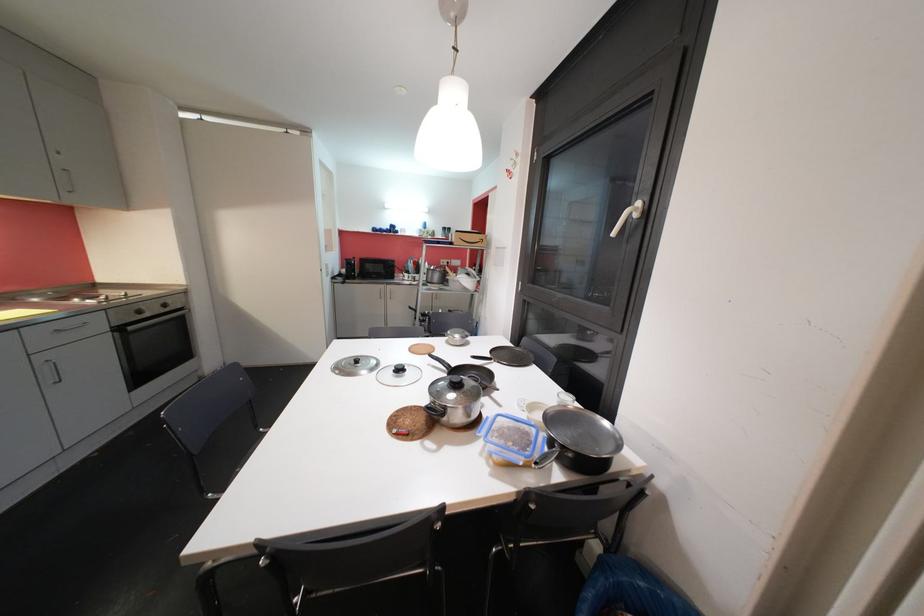
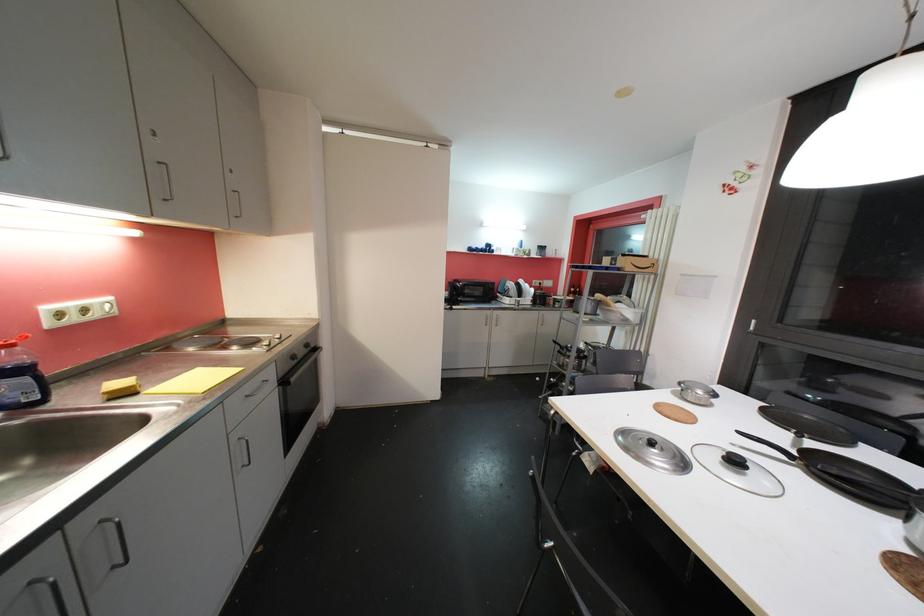
Question: What movement of the cameraman would produce the second image?

Choices:
 (A) Left
 (B) Right
 (C) Forward
 (D) Backward

Answer: (A)